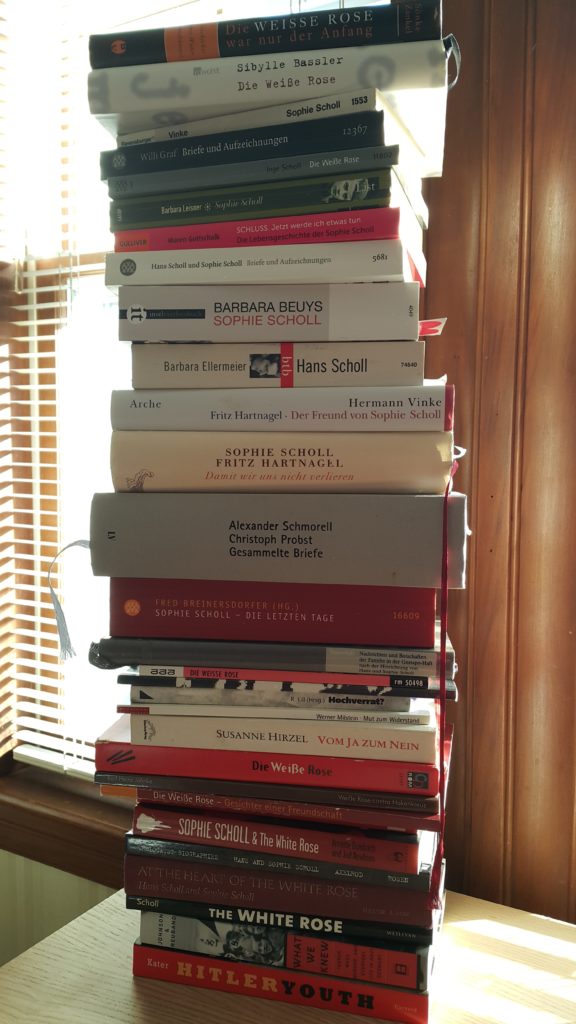
I want to click on books with things sticking out of them, so click(x=390, y=60), click(x=339, y=306), click(x=371, y=357), click(x=373, y=447), click(x=298, y=530), click(x=173, y=651).